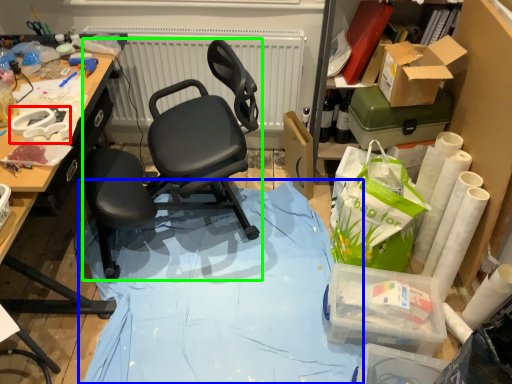
Question: Which object is positioned closest to equipment (highlighted by a red box)? Select from fabric (highlighted by a blue box) and chair (highlighted by a green box).

Choices:
 (A) fabric
 (B) chair

Answer: (B)